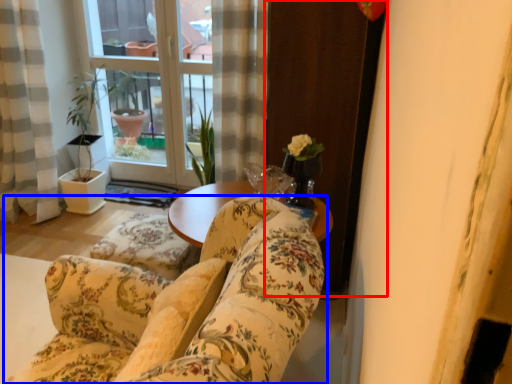
Question: Among these objects, which one is farthest to the camera, screen door (highlighted by a red box) or studio couch (highlighted by a blue box)?

Choices:
 (A) screen door
 (B) studio couch

Answer: (A)